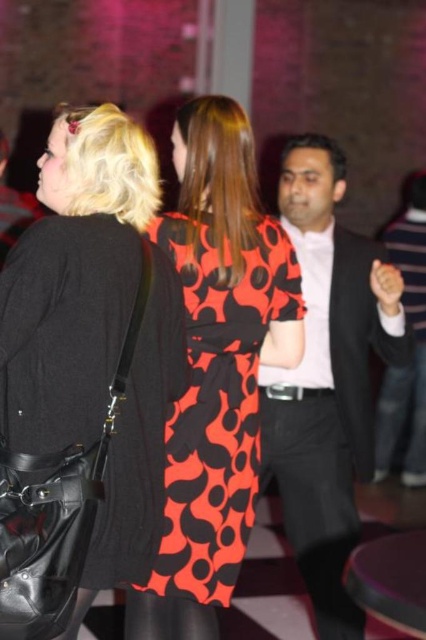
Consider the image. You are a fashion designer analyzing the outfit of the woman in the center. Given that the matte black suit at center and the black leather belt at center are part of her outfit, which one is bigger in size?

The matte black suit at center has a larger size compared to the black leather belt at center, so the matte black suit at center is bigger in size.

You are a photographer at this event and want to capture a photo of the matte black dress at center and the matte black suit at center. Based on their heights, which one should you position closer to the camera to ensure both appear equally tall in the photo?

The matte black dress at center is not as tall as the matte black suit at center. To make them appear equally tall in the photo, position the matte black dress at center closer to the camera since it is shorter than the matte black suit at center.